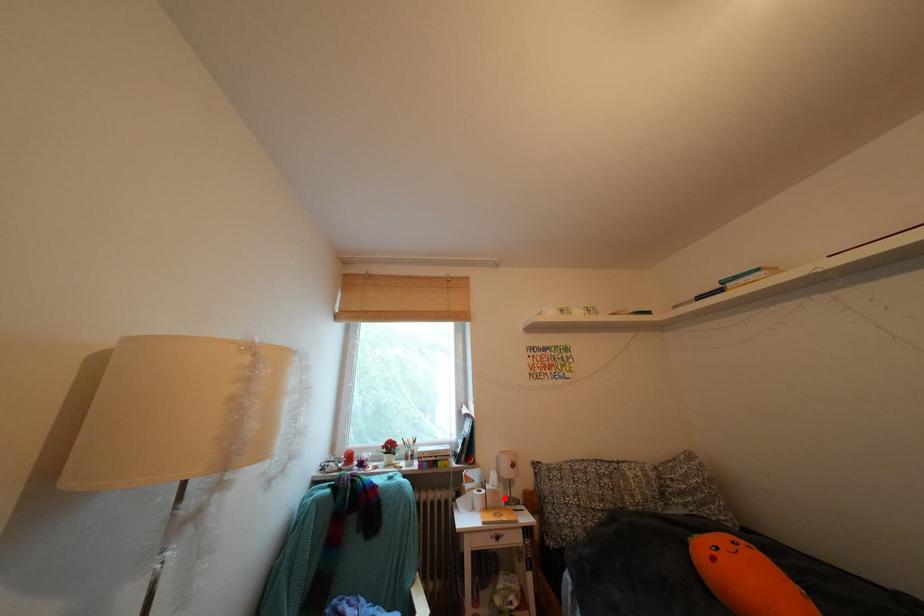
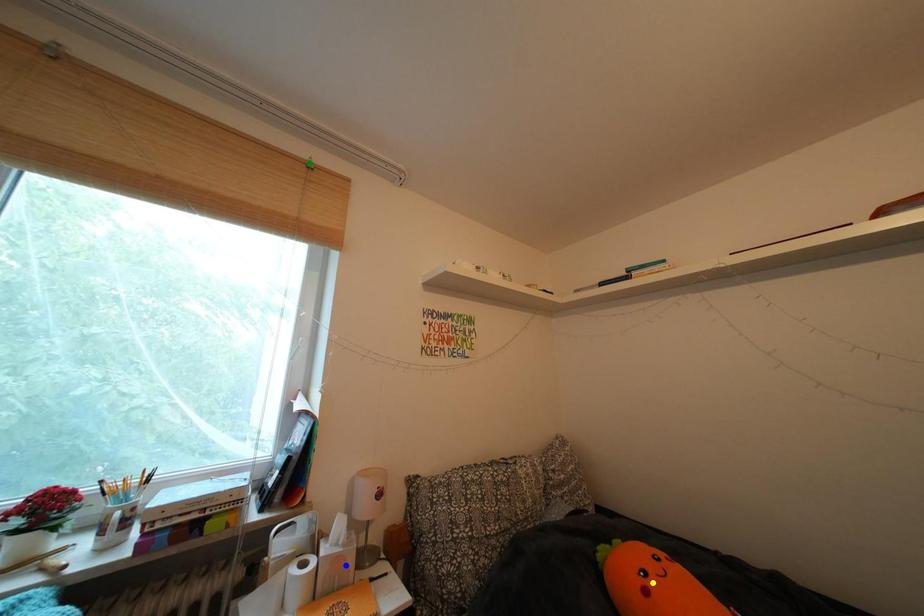
Question: I am providing you with two images of the same scene from different viewpoints. A red point is marked on the first image. You are given multiple points on the second image. Which point in image 2 is actually the same real-world point as the red point in image 1?

Choices:
 (A) yellow point
 (B) blue point
 (C) green point

Answer: (B)